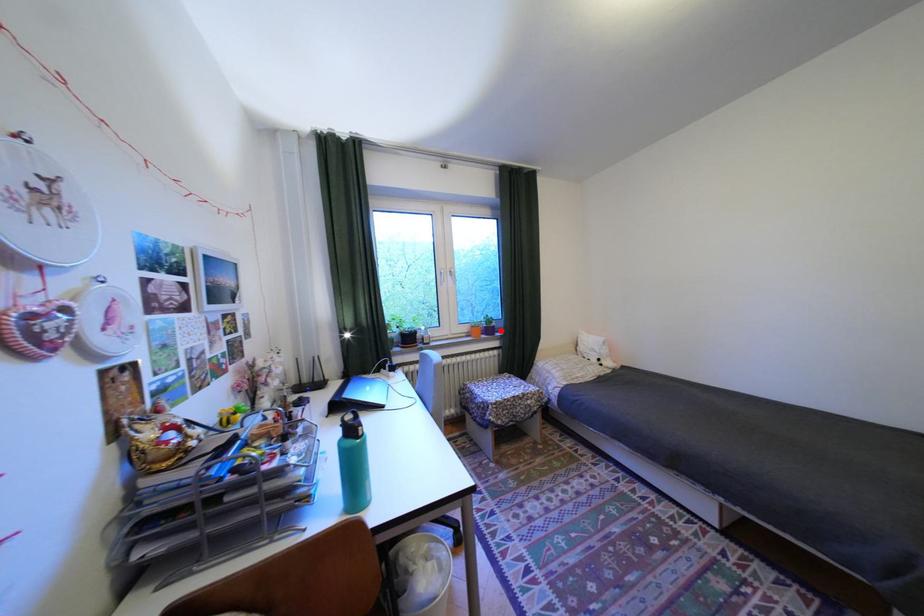
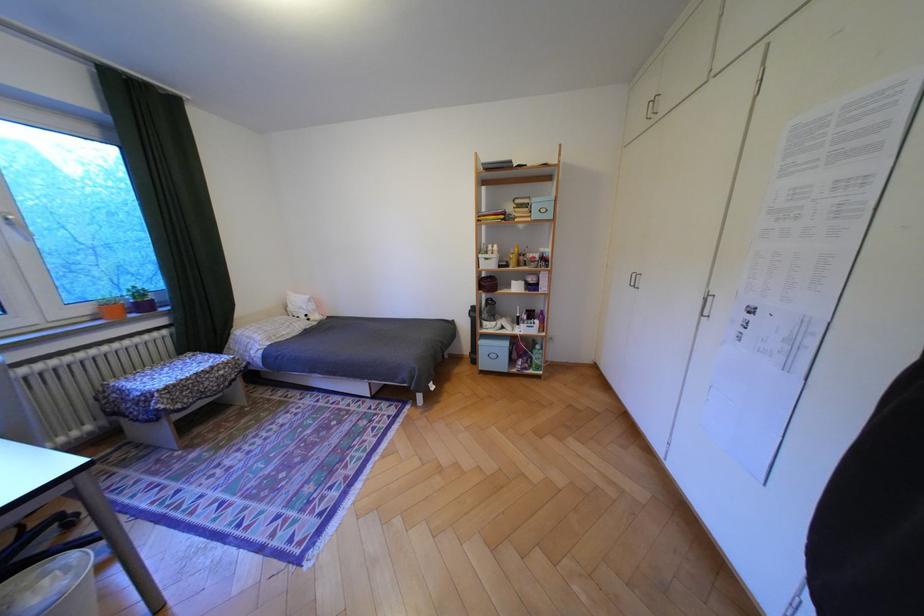
Locate, in the second image, the point that corresponds to the highlighted location in the first image.

(155, 307)